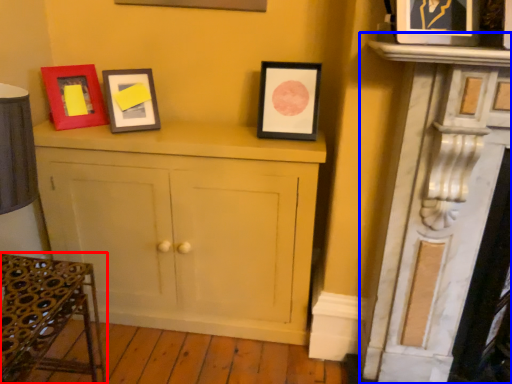
Question: Among these objects, which one is nearest to the camera, furniture (highlighted by a red box) or fireplace (highlighted by a blue box)?

Choices:
 (A) furniture
 (B) fireplace

Answer: (A)